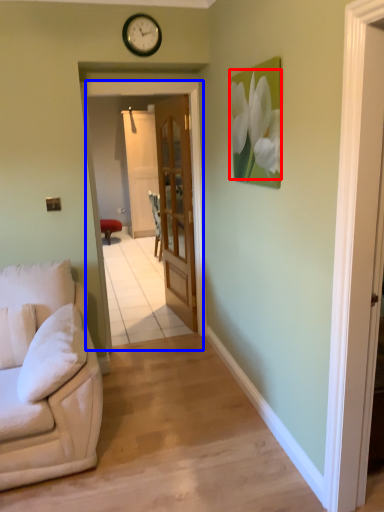
Question: Which of the following is the farthest to the observer, flower (highlighted by a red box) or screen door (highlighted by a blue box)?

Choices:
 (A) flower
 (B) screen door

Answer: (B)